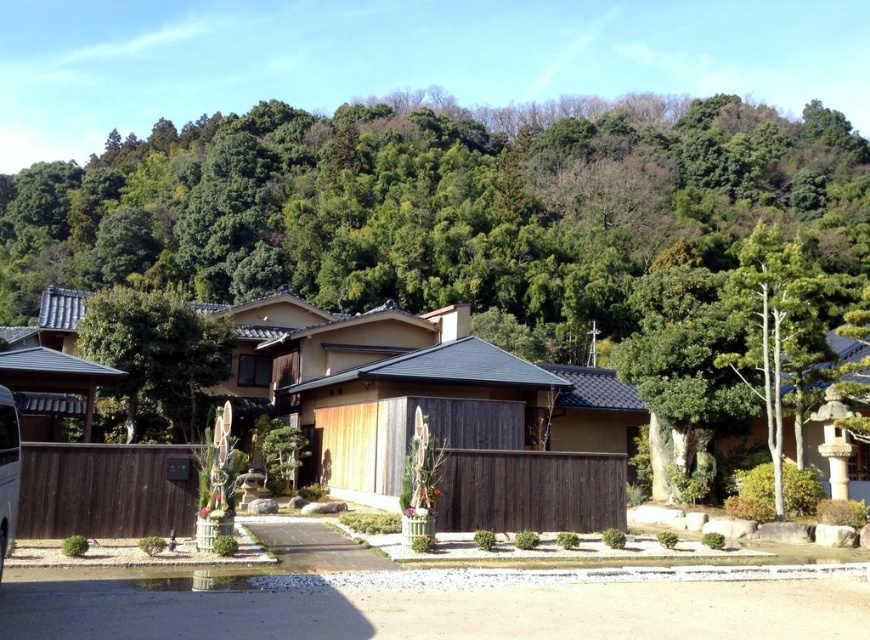
Who is more distant from viewer, (131, 371) or (17, 412)?

The point (131, 371) is behind.

Which is below, green wood tree at center or metallic silver van at lower left?

metallic silver van at lower left is lower down.

Which is in front, point (202, 339) or point (2, 484)?

Point (2, 484) is in front.

The height and width of the screenshot is (640, 870). Identify the location of green wood tree at center. (156, 352).

Between smooth asphalt driveway at center and metallic silver van at lower left, which one appears on the left side from the viewer's perspective?

From the viewer's perspective, metallic silver van at lower left appears more on the left side.

Which of these two, smooth asphalt driveway at center or metallic silver van at lower left, stands taller?

Standing taller between the two is metallic silver van at lower left.

Where is `smooth asphalt driveway at center`? This screenshot has height=640, width=870. smooth asphalt driveway at center is located at coordinates (440, 609).

At what (x,y) coordinates should I click in order to perform the action: click on smooth asphalt driveway at center. Please return your answer as a coordinate pair (x, y). The height and width of the screenshot is (640, 870). Looking at the image, I should click on (440, 609).

Between smooth asphalt driveway at center and green wood tree at center, which one has less height?

smooth asphalt driveway at center

Which is behind, point (603, 628) or point (139, 298)?

The point (139, 298) is more distant.

In order to click on smooth asphalt driveway at center in this screenshot , I will do `click(440, 609)`.